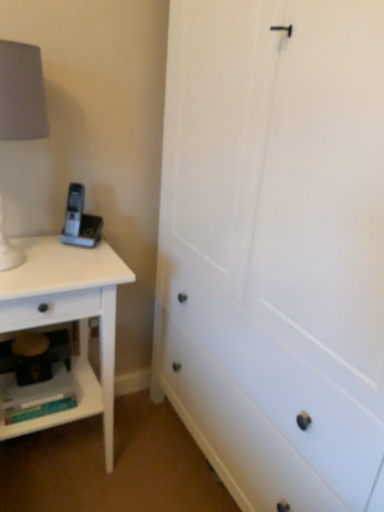
The image size is (384, 512). What are the coordinates of `free spot below white matte lampshade at left (from a real-world perspective)` in the screenshot? It's located at (24, 260).